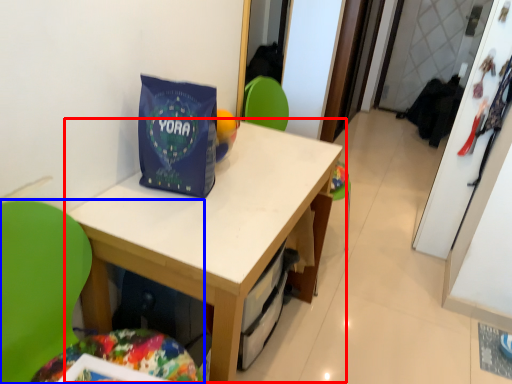
Question: Which object is further to the camera taking this photo, table (highlighted by a red box) or chair (highlighted by a blue box)?

Choices:
 (A) table
 (B) chair

Answer: (A)